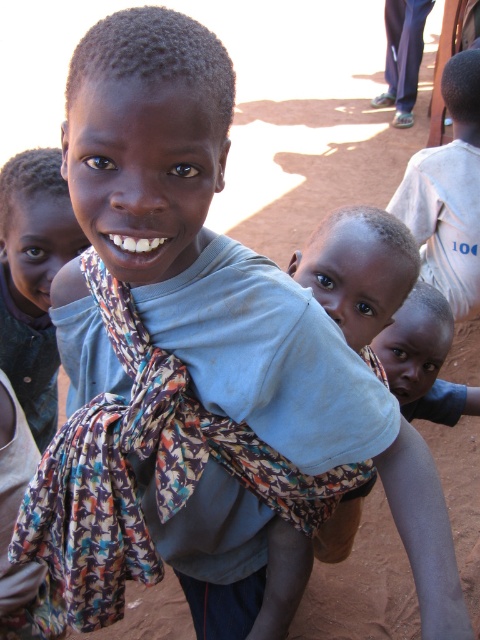
Question: Which point is closer to the camera?

Choices:
 (A) (75, 248)
 (B) (443, 216)

Answer: (A)

Question: Is light blue fabric at center wider than white cotton shirt at right?

Choices:
 (A) no
 (B) yes

Answer: (A)

Question: Is the position of light blue fabric at center more distant than that of white cotton shirt at right?

Choices:
 (A) no
 (B) yes

Answer: (A)

Question: Which point is farther to the camera?

Choices:
 (A) white cotton shirt at right
 (B) light blue fabric at center

Answer: (A)

Question: Which point is closer to the camera taking this photo?

Choices:
 (A) (32, 232)
 (B) (463, 221)

Answer: (A)

Question: Does light blue fabric at center come behind white cotton shirt at right?

Choices:
 (A) no
 (B) yes

Answer: (A)